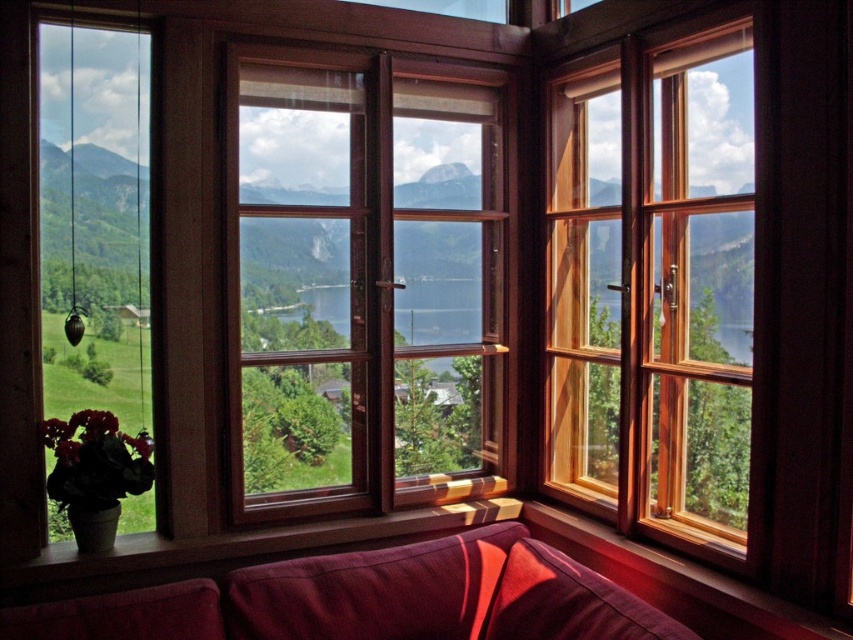
You are an interior designer assessing the space in the image. You need to place a new rectangular side table between the wooden window at upper right and the velvet burgundy couch at lower center. The side table must be narrower than both objects. Can the side table fit in this space?

The wooden window at upper right is thinner than the velvet burgundy couch at lower center. Since the side table needs to be narrower than both, it can fit as long as its width is less than the thinner object, which is the wooden window at upper right.

You are standing in the room looking through the bay window. There are two points marked on the window glass, one at coordinates point (363, 476) and the other at point (570, 212). Which point is closer to you as you look through the window?

Point (363, 476) is in front of point (570, 212), so it is closer to you as you look through the window.

You are standing in a room with a bay window divided into four sections. You notice a point marked at coordinates (x=654, y=285). Which section of the bay window does this point correspond to?

The point (x=654, y=285) corresponds to the wooden window at upper right section of the bay window.